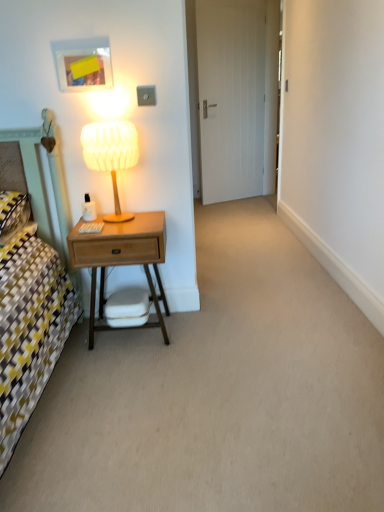
Question: Which is correct: white matte swivel chair at center is inside wooden table lamp at left, or outside of it?

Choices:
 (A) outside
 (B) inside

Answer: (A)

Question: From the image's perspective, is white matte swivel chair at center positioned above or below wooden table lamp at left?

Choices:
 (A) above
 (B) below

Answer: (B)

Question: Which object is positioned closest to the white matte swivel chair at center?

Choices:
 (A) wooden nightstand at left
 (B) white matte door at center
 (C) wooden table lamp at left

Answer: (A)

Question: Estimate the real-world distances between objects in this image. Which object is farther from the wooden table lamp at left?

Choices:
 (A) white matte swivel chair at center
 (B) white matte door at center
 (C) wooden nightstand at left

Answer: (B)